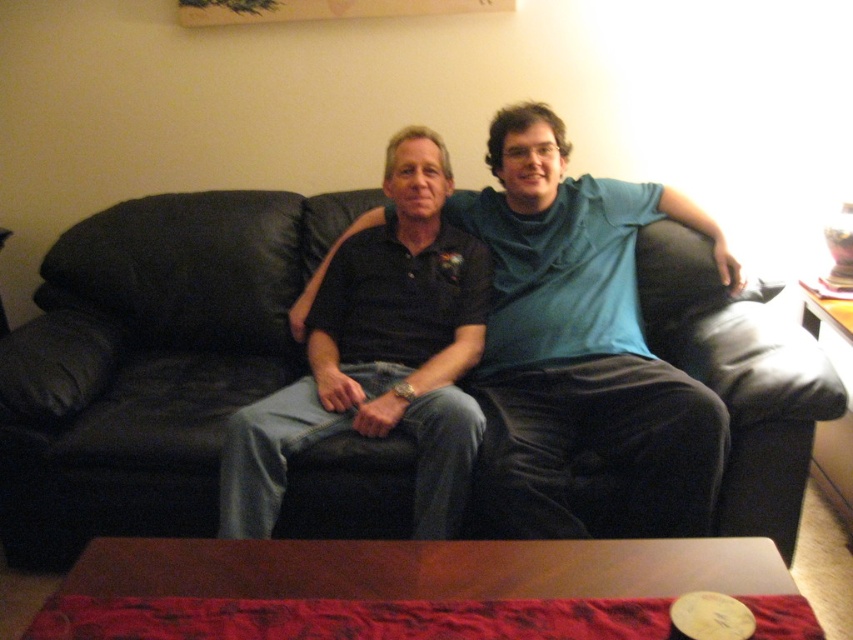
Does matte black couch at center appear on the left side of matte black shirt at center?

Incorrect, matte black couch at center is not on the left side of matte black shirt at center.

Who is more forward, (602,186) or (329,435)?

Positioned in front is point (329,435).

Find the location of a particular element. matte black couch at center is located at coordinates (582, 340).

Between point (770, 344) and point (532, 406), which one is positioned behind?

The point (770, 344) is behind.

Image resolution: width=853 pixels, height=640 pixels. Identify the location of black leather couch at center. (149, 362).

Can you confirm if black leather couch at center is smaller than matte black shirt at center?

No.

This screenshot has width=853, height=640. What are the coordinates of `black leather couch at center` in the screenshot? It's located at (149, 362).